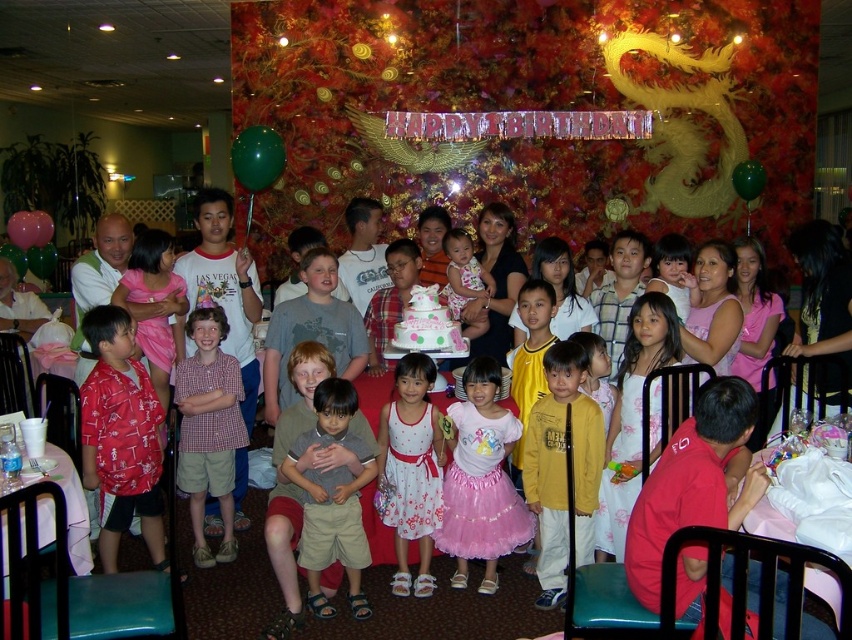
Question: Does pink satin cake at center have a smaller size compared to pink tulle skirt at center?

Choices:
 (A) no
 (B) yes

Answer: (A)

Question: Which point appears farthest from the camera in this image?

Choices:
 (A) tap(422, 326)
 (B) tap(194, 323)
 (C) tap(577, 481)

Answer: (A)

Question: Which object appears farthest from the camera in this image?

Choices:
 (A) plaid cotton shirt at center
 (B) white floral dress at center
 (C) floral dress at center

Answer: (C)

Question: Considering the relative positions of pink satin cake at center and light brown cotton shorts at center in the image provided, where is pink satin cake at center located with respect to light brown cotton shorts at center?

Choices:
 (A) below
 (B) above

Answer: (A)

Question: Among these points, which one is farthest from the camera?

Choices:
 (A) (372, 406)
 (B) (476, 477)

Answer: (A)

Question: Can you confirm if pink tulle skirt at center is positioned to the right of floral dress at center?

Choices:
 (A) yes
 (B) no

Answer: (A)